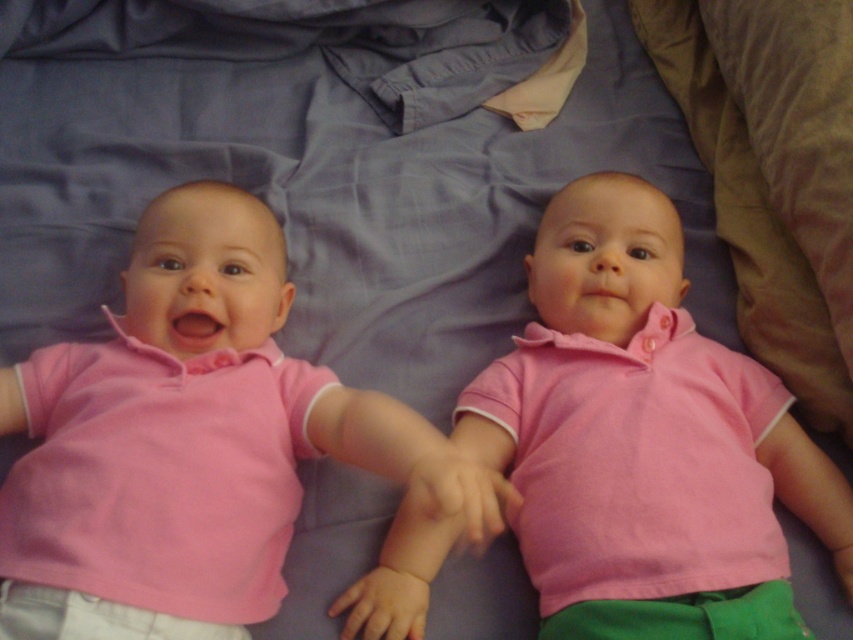
You are a photographer taking a picture of the two babies lying on the bed. You want to focus on the point that is closer to you. Which point should you choose between point (221, 520) and point (711, 449)?

Point (221, 520) is closer to the viewer than point (711, 449), so you should choose point (221, 520) to focus on the closer point.

You are a photographer taking a picture of the two babies wearing the matte pink shirt at center and the pink cotton shirt at center. Which shirt will appear larger in the photo?

The matte pink shirt at center will appear larger in the photo because it is closer to the viewer than the pink cotton shirt at center.

You are a photographer trying to capture a closeup of both the matte pink shirt at center and the pink cotton shirt at center while ensuring they are both fully visible in the frame. Given their sizes, which shirt should you focus on to ensure the smaller one is adequately captured?

The matte pink shirt at center is smaller than the pink cotton shirt at center, so focusing on the matte pink shirt at center will ensure it is adequately captured in the closeup while still including the larger pink cotton shirt at center in the frame.